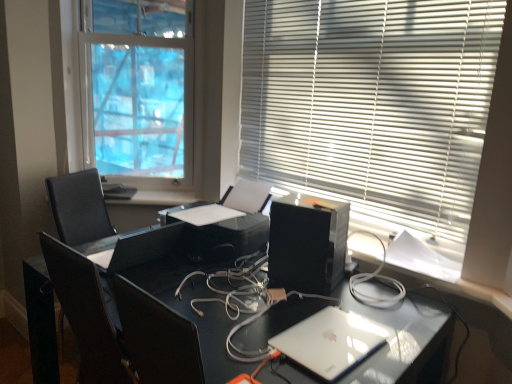
Image resolution: width=512 pixels, height=384 pixels. What are the coordinates of `white blinds at upper right, the first window blind positioned from the left` in the screenshot? It's located at (143, 91).

The height and width of the screenshot is (384, 512). Describe the element at coordinates (143, 91) in the screenshot. I see `white blinds at upper right, the first window blind when ordered from back to front` at that location.

In order to face black plastic desktop computer at center, should I rotate leftwards or rightwards?

Turn right by 7.283 degrees to look at black plastic desktop computer at center.

What do you see at coordinates (155, 198) in the screenshot?
I see `white glossy window sill at center` at bounding box center [155, 198].

I want to click on white plastic blinds at upper right, the 2th window blind from the back, so click(x=372, y=104).

Locate an element on the screen. satin white laptop at lower right is located at coordinates (330, 341).

This screenshot has height=384, width=512. In order to click on matte black monitor at center in this screenshot , I will do (x=144, y=247).

The image size is (512, 384). I want to click on black plastic printer at center, so click(233, 226).

This screenshot has height=384, width=512. What are the coordinates of `white blinds at upper right, which is the second window blind in right-to-left order` in the screenshot? It's located at (143, 91).

Could you tell me if matte black monitor at center is facing black plastic desktop computer at center?

No.

Considering the sizes of objects matte black monitor at center and black plastic desktop computer at center in the image provided, who is wider, matte black monitor at center or black plastic desktop computer at center?

With larger width is matte black monitor at center.

Would you consider matte black monitor at center to be distant from black plastic desktop computer at center?

They are positioned close to each other.

Considering the positions of objects matte black monitor at center and black plastic desktop computer at center in the image provided, who is in front, matte black monitor at center or black plastic desktop computer at center?

black plastic desktop computer at center is in front.

Is matte black monitor at center not inside satin black desk at center?

Yes, matte black monitor at center is not within satin black desk at center.

From a real-world perspective, is matte black monitor at center above or below satin black desk at center?

From a real-world perspective, matte black monitor at center is physically above satin black desk at center.

Which is more to the left, matte black monitor at center or satin black desk at center?

From the viewer's perspective, matte black monitor at center appears more on the left side.

Considering the sizes of objects matte black monitor at center and satin black desk at center in the image provided, who is wider, matte black monitor at center or satin black desk at center?

satin black desk at center.

How distant is satin black desk at center from white blinds at upper right, positioned as the 2th window blind in front-to-back order?

A distance of 1.19 meters exists between satin black desk at center and white blinds at upper right, positioned as the 2th window blind in front-to-back order.

Which of these two, satin black desk at center or white blinds at upper right, the first window blind positioned from the left, stands taller?

white blinds at upper right, the first window blind positioned from the left.

Can you confirm if satin black desk at center is wider than white blinds at upper right, which is the second window blind in right-to-left order?

Correct, the width of satin black desk at center exceeds that of white blinds at upper right, which is the second window blind in right-to-left order.

Consider the image. Is satin black desk at center at the left side of white blinds at upper right, which is the second window blind in right-to-left order?

No, satin black desk at center is not to the left of white blinds at upper right, which is the second window blind in right-to-left order.

Which object is closer to the camera taking this photo, satin white laptop at lower right or black plastic printer at center?

satin white laptop at lower right is closer to the camera.

From a real-world perspective, is satin white laptop at lower right positioned over black plastic printer at center based on gravity?

Actually, satin white laptop at lower right is physically below black plastic printer at center in the real world.

Considering the sizes of objects satin white laptop at lower right and black plastic printer at center in the image provided, who is taller, satin white laptop at lower right or black plastic printer at center?

black plastic printer at center.

From the image's perspective, which object appears higher, satin white laptop at lower right or black plastic printer at center?

black plastic printer at center.

Which is behind, point (121, 245) or point (389, 211)?

Point (389, 211)

Considering the relative positions of matte black monitor at center and white plastic blinds at upper right, which is the 1th window blind from right to left, in the image provided, is matte black monitor at center to the left or to the right of white plastic blinds at upper right, which is the 1th window blind from right to left,?

In the image, matte black monitor at center appears on the left side of white plastic blinds at upper right, which is the 1th window blind from right to left.

Is matte black monitor at center taller than white plastic blinds at upper right, which is the 1th window blind from front to back?

No.

Which of these two, white blinds at upper right, the first window blind when ordered from back to front, or satin white laptop at lower right, is wider?

With larger width is satin white laptop at lower right.

Between white blinds at upper right, positioned as the 2th window blind in front-to-back order, and satin white laptop at lower right, which one has larger size?

white blinds at upper right, positioned as the 2th window blind in front-to-back order.

In the scene shown: Between white blinds at upper right, the first window blind when ordered from back to front, and satin white laptop at lower right, which one appears on the right side from the viewer's perspective?

From the viewer's perspective, satin white laptop at lower right appears more on the right side.

Looking at this image, what's the angular difference between white blinds at upper right, the first window blind positioned from the left, and satin white laptop at lower right's facing directions?

The angle between the facing direction of white blinds at upper right, the first window blind positioned from the left, and the facing direction of satin white laptop at lower right is 48.5 degrees.

Find the location of `desk below the matte black monitor at center (from the image's perspective)`. desk below the matte black monitor at center (from the image's perspective) is located at coordinates (168, 312).

Is satin black desk at center in front of or behind matte black monitor at center in the image?

Visually, satin black desk at center is located in front of matte black monitor at center.

Between satin black desk at center and matte black monitor at center, which one appears on the left side from the viewer's perspective?

matte black monitor at center is more to the left.

Between satin black desk at center and matte black monitor at center, which one has larger width?

satin black desk at center is wider.

Identify the location of desktop computer in front of the matte black monitor at center. (307, 243).

Find the location of a particular element. desk below the matte black monitor at center (from the image's perspective) is located at coordinates (168, 312).

Looking at the image, which one is located further to white blinds at upper right, positioned as the 2th window blind in front-to-back order, satin white laptop at lower right or black plastic printer at center?

Based on the image, satin white laptop at lower right appears to be further to white blinds at upper right, positioned as the 2th window blind in front-to-back order.

From the image, which object appears to be farther from white blinds at upper right, positioned as the 2th window blind in front-to-back order, matte black monitor at center or black plastic desktop computer at center?

The object further to white blinds at upper right, positioned as the 2th window blind in front-to-back order, is black plastic desktop computer at center.

Consider the image. Which object lies further to the anchor point satin white laptop at lower right, white plastic blinds at upper right, the 2th window blind from the back, or white blinds at upper right, positioned as the 2th window blind in front-to-back order?

white blinds at upper right, positioned as the 2th window blind in front-to-back order, lies further to satin white laptop at lower right than the other object.

Based on their spatial positions, is satin white laptop at lower right or white plastic blinds at upper right, the 2th window blind from the back, closer to white glossy window sill at center?

white plastic blinds at upper right, the 2th window blind from the back, lies closer to white glossy window sill at center than the other object.

Estimate the real-world distances between objects in this image. Which object is further from black plastic desktop computer at center, satin white laptop at lower right or satin black desk at center?

satin white laptop at lower right lies further to black plastic desktop computer at center than the other object.

Estimate the real-world distances between objects in this image. Which object is further from white plastic blinds at upper right, positioned as the 2th window blind in left-to-right order, satin black desk at center or matte black monitor at center?

matte black monitor at center lies further to white plastic blinds at upper right, positioned as the 2th window blind in left-to-right order, than the other object.

From the picture: Based on their spatial positions, is black plastic printer at center or satin white laptop at lower right further from matte black monitor at center?

Based on the image, satin white laptop at lower right appears to be further to matte black monitor at center.

Looking at the image, which one is located closer to satin white laptop at lower right, black plastic desktop computer at center or white plastic blinds at upper right, positioned as the 2th window blind in left-to-right order?

Based on the image, black plastic desktop computer at center appears to be nearer to satin white laptop at lower right.

Locate an element on the screen. printer between white plastic blinds at upper right, positioned as the 2th window blind in left-to-right order, and satin black desk at center in the up-down direction is located at coordinates (233, 226).

Identify the location of desktop computer between satin black desk at center and white glossy window sill at center from front to back. This screenshot has height=384, width=512. (307, 243).

Locate an element on the screen. This screenshot has width=512, height=384. computer monitor situated between white blinds at upper right, the first window blind when ordered from back to front, and black plastic desktop computer at center from left to right is located at coordinates (144, 247).

You are a GUI agent. You are given a task and a screenshot of the screen. Output one action in this format:
    pyautogui.click(x=<x>, y=<y>)
    Task: Click on the laptop between satin black desk at center and black plastic desktop computer at center from front to back
    The image size is (512, 384).
    Given the screenshot: What is the action you would take?
    pyautogui.click(x=330, y=341)